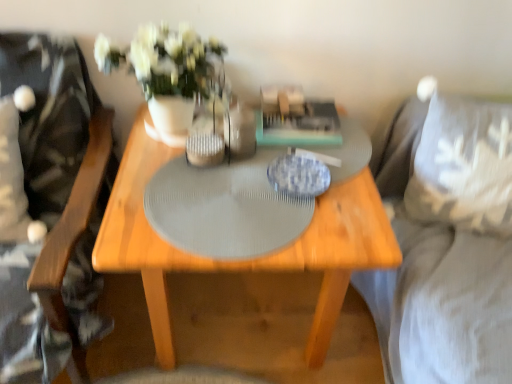
Locate an element on the screen. The width and height of the screenshot is (512, 384). vacant region above gray textured placemat at center (from a real-world perspective) is located at coordinates pyautogui.click(x=242, y=194).